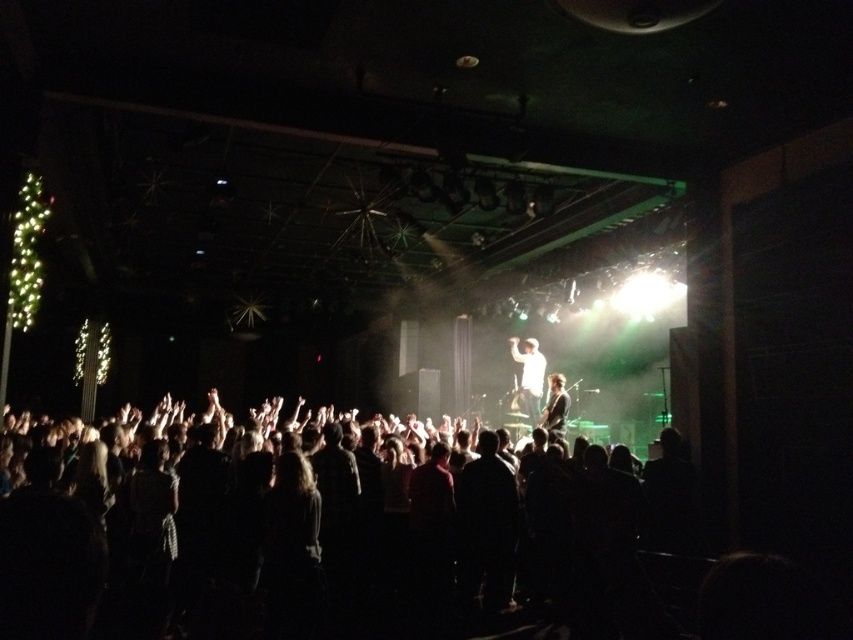
Question: Does dark clothing crowd at center appear under white matte shirt at center?

Choices:
 (A) no
 (B) yes

Answer: (B)

Question: Can you confirm if dark clothing crowd at center is thinner than white matte shirt at center?

Choices:
 (A) no
 (B) yes

Answer: (B)

Question: Can you confirm if dark clothing crowd at center is thinner than white matte shirt at center?

Choices:
 (A) no
 (B) yes

Answer: (B)

Question: Which of the following is the farthest from the observer?

Choices:
 (A) (277, 550)
 (B) (527, 412)

Answer: (B)